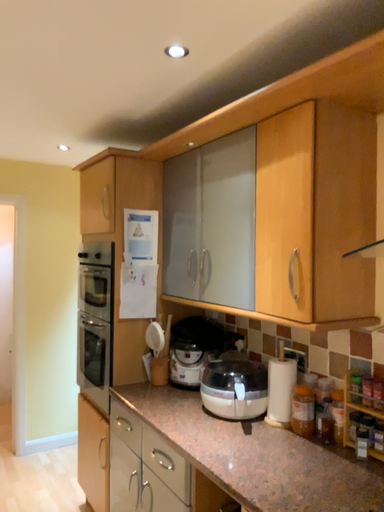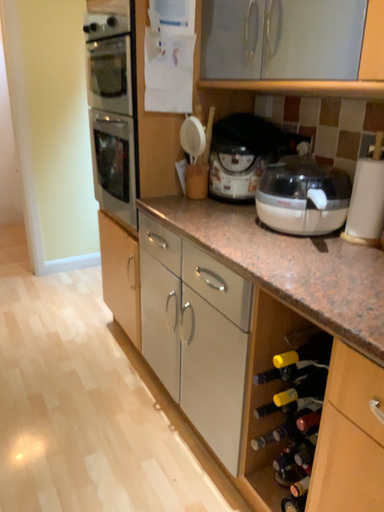
Question: How did the camera likely rotate when shooting the video?

Choices:
 (A) rotated upward
 (B) rotated downward

Answer: (B)